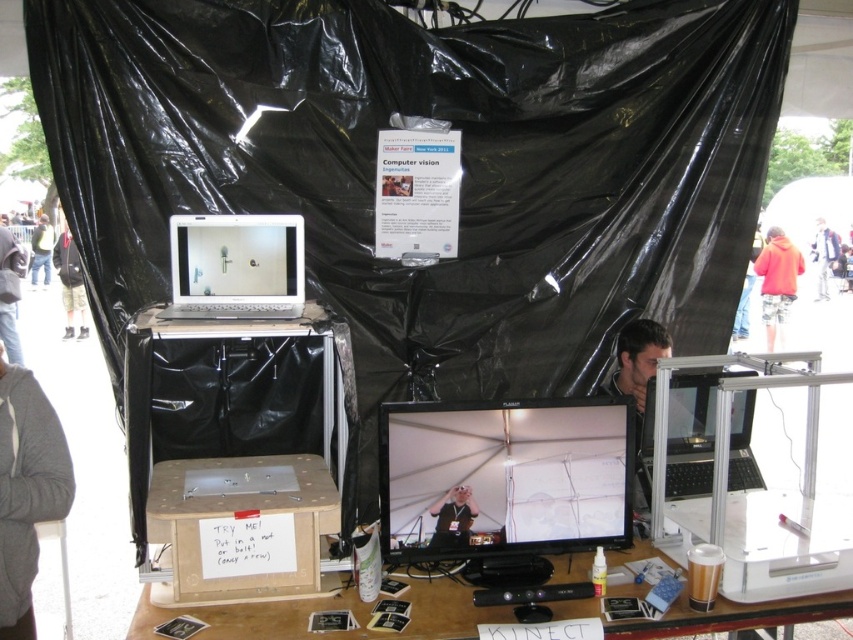
Who is more distant from viewer, [262,244] or [836,252]?

Point [836,252]

Does point (219, 285) come closer to viewer compared to point (821, 237)?

That is True.

At what (x,y) coordinates should I click in order to perform the action: click on white glossy laptop at upper center. Please return your answer as a coordinate pair (x, y). The width and height of the screenshot is (853, 640). Looking at the image, I should click on (236, 266).

Is wooden at center to the left of black plastic laptop at center from the viewer's perspective?

Yes, wooden at center is to the left of black plastic laptop at center.

Which is behind, point (236, 328) or point (732, 422)?

The point (732, 422) is more distant.

Where is `wooden at center`? The height and width of the screenshot is (640, 853). wooden at center is located at coordinates (219, 378).

Can you confirm if matte black monitor at center is positioned to the left of wooden table at center?

No, matte black monitor at center is not to the left of wooden table at center.

Is matte black monitor at center further to the viewer compared to wooden table at center?

That is True.

Which is in front, point (432, 520) or point (744, 627)?

Point (744, 627) is in front.

Image resolution: width=853 pixels, height=640 pixels. What are the coordinates of `matte black monitor at center` in the screenshot? It's located at (503, 477).